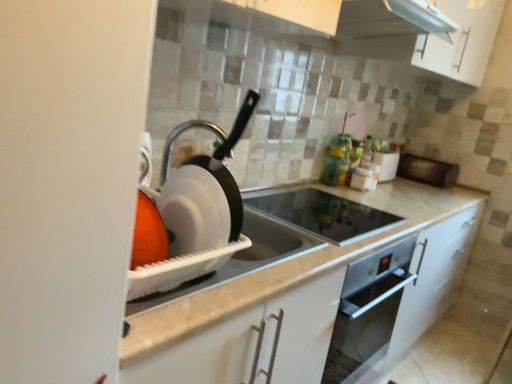
The image size is (512, 384). I want to click on vacant space in front of white glossy toaster at upper right, the 3th appliance in the left-to-right sequence, so click(x=397, y=187).